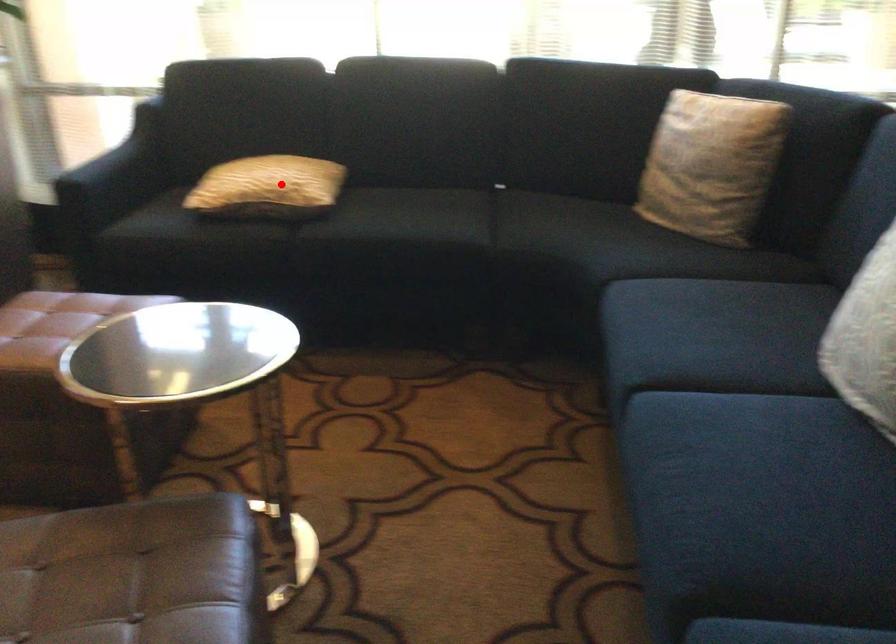
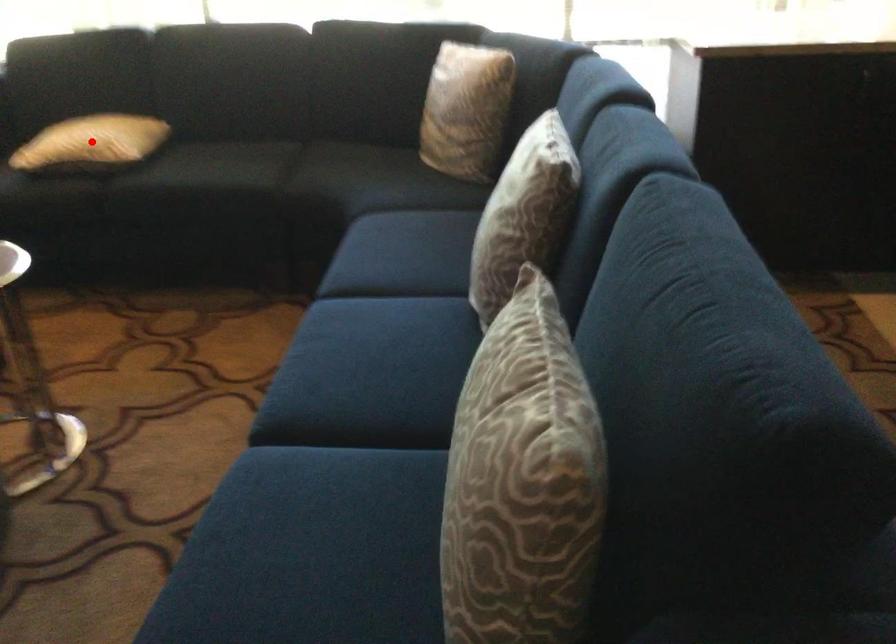
I am providing you with two images of the same scene from different viewpoints. A red point is marked on the first image and another point is marked on the second image. Does the point marked in image1 correspond to the same location as the one in image2?

Yes